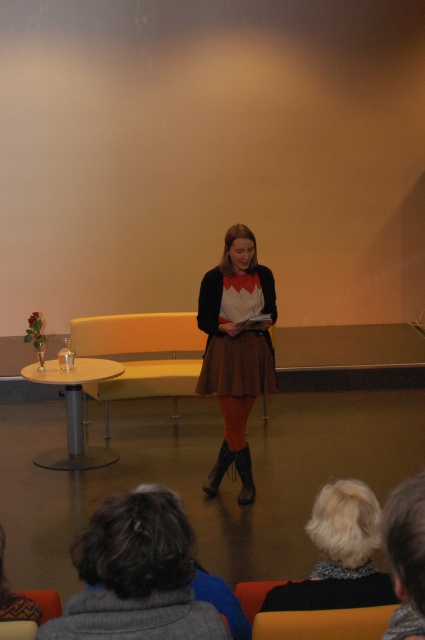
Based on the photo, you are a fashion designer observing the woman on stage. You need to determine the vertical positioning of her clothing items. Which clothing item, the fluffy gray sweater at lower center or the brown textured skirt at center, is positioned lower on her body?

The fluffy gray sweater at lower center has a lesser height compared to the brown textured skirt at center, so the fluffy gray sweater at lower center is positioned lower on her body.

You are a stagehand who needs to move a 2.5 meter long ladder from the backstage to the front of the stage. The ladder must pass between the matte brown skirt at center and the fluffy gray sweater at lower center. Is there enough space for the ladder to fit through the gap between them?

The distance between the matte brown skirt at center and the fluffy gray sweater at lower center is 2.20 meters. Since the ladder is 2.5 meters long, it is longer than the available space, so the ladder cannot fit through the gap between them.